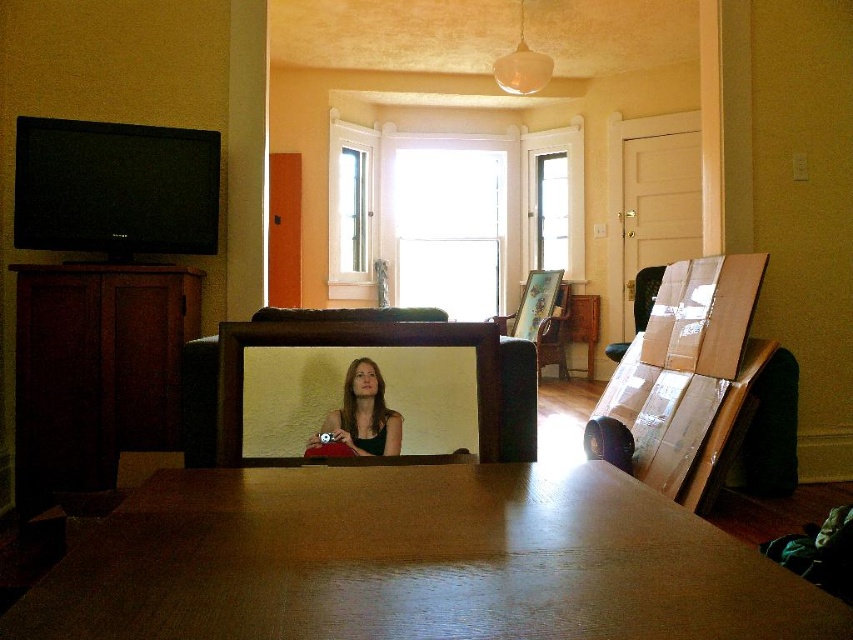
Question: Which point is farther to the camera?

Choices:
 (A) matte black hair at center
 (B) wooden table at center

Answer: (A)

Question: Does wooden table at center have a larger size compared to matte black hair at center?

Choices:
 (A) yes
 (B) no

Answer: (A)

Question: In this image, where is wooden table at center located relative to matte black hair at center?

Choices:
 (A) below
 (B) above

Answer: (B)

Question: Can you confirm if wooden table at center is thinner than matte black hair at center?

Choices:
 (A) yes
 (B) no

Answer: (B)